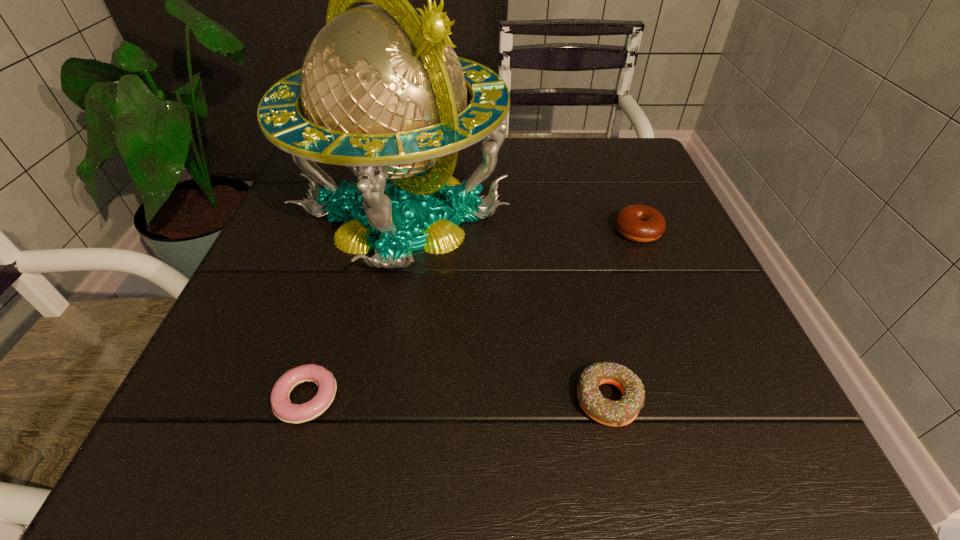
Where is `vacant area at the far right corner of the desktop`? The height and width of the screenshot is (540, 960). vacant area at the far right corner of the desktop is located at coordinates click(x=638, y=137).

This screenshot has width=960, height=540. Find the location of `vacant point at the near right corner`. vacant point at the near right corner is located at coordinates (708, 463).

This screenshot has height=540, width=960. What are the coordinates of `vacant area between the tallest object and the rightmost doughnut` in the screenshot? It's located at (520, 222).

You are a GUI agent. You are given a task and a screenshot of the screen. Output one action in this format:
    pyautogui.click(x=<x>, y=<y>)
    Task: Click on the free space between the shortest doughnut and the second object from right to left
    This screenshot has width=960, height=540.
    Given the screenshot: What is the action you would take?
    [457, 399]

I want to click on vacant space that's between the shortest doughnut and the globe, so click(x=355, y=306).

This screenshot has width=960, height=540. Find the location of `vacant area that lies between the shortest object and the second shortest object`. vacant area that lies between the shortest object and the second shortest object is located at coordinates (457, 399).

At what (x,y) coordinates should I click in order to perform the action: click on empty space between the shortest object and the rightmost object. Please return your answer as a coordinate pair (x, y). Looking at the image, I should click on (472, 314).

Find the location of a particular element. empty location between the third tallest object and the globe is located at coordinates (506, 307).

Where is `vacant area between the leftmost doughnut and the globe`? vacant area between the leftmost doughnut and the globe is located at coordinates (355, 306).

Where is `vacant space that's between the globe and the second doughnut from right to left`? This screenshot has height=540, width=960. vacant space that's between the globe and the second doughnut from right to left is located at coordinates (506, 307).